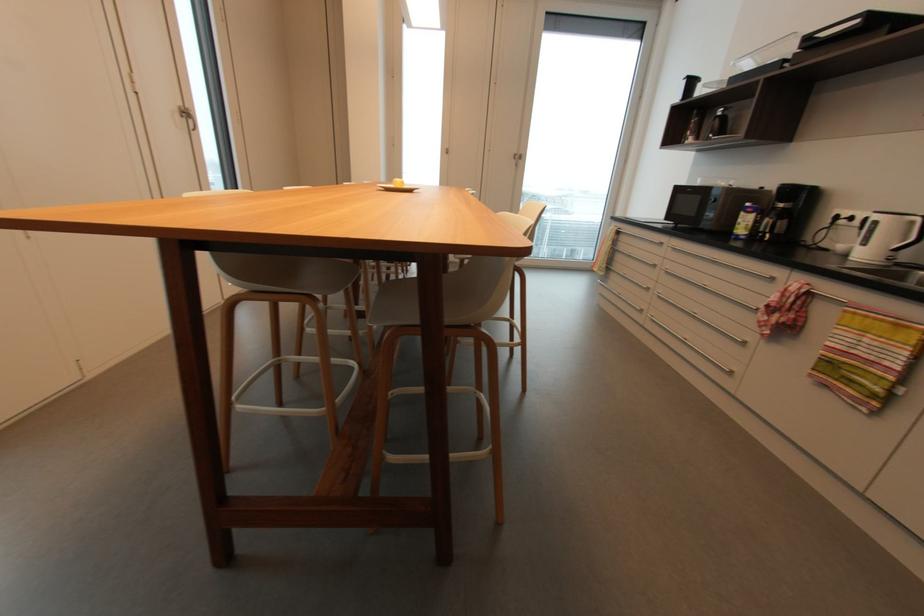
The image size is (924, 616). I want to click on blue drink carton, so click(745, 221).